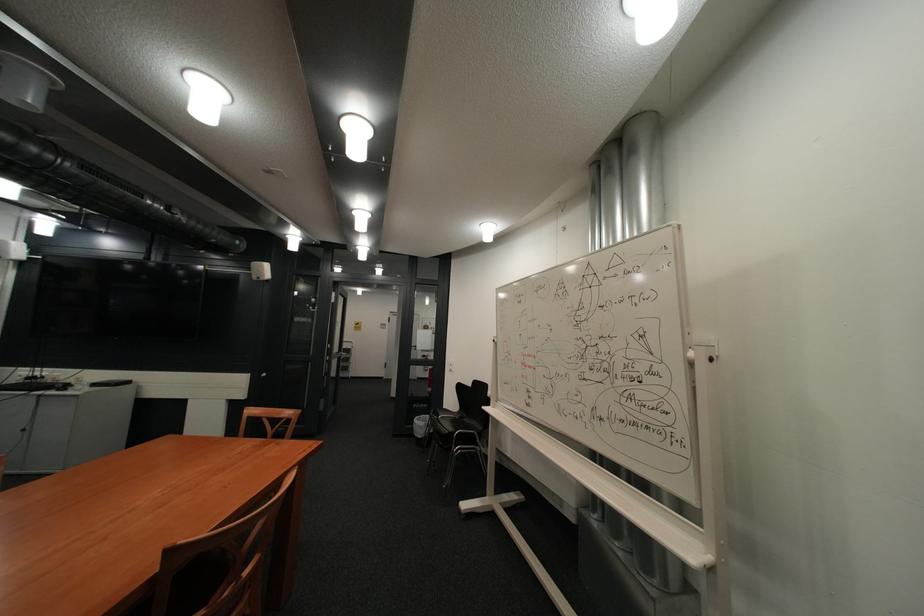
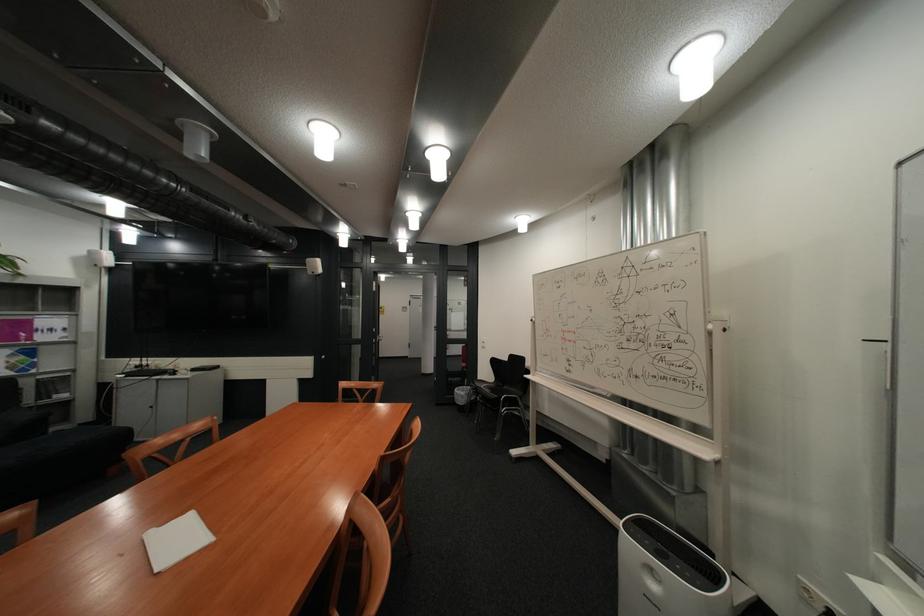
Locate, in the second image, the point that corresponds to [707,354] in the first image.

(725, 326)